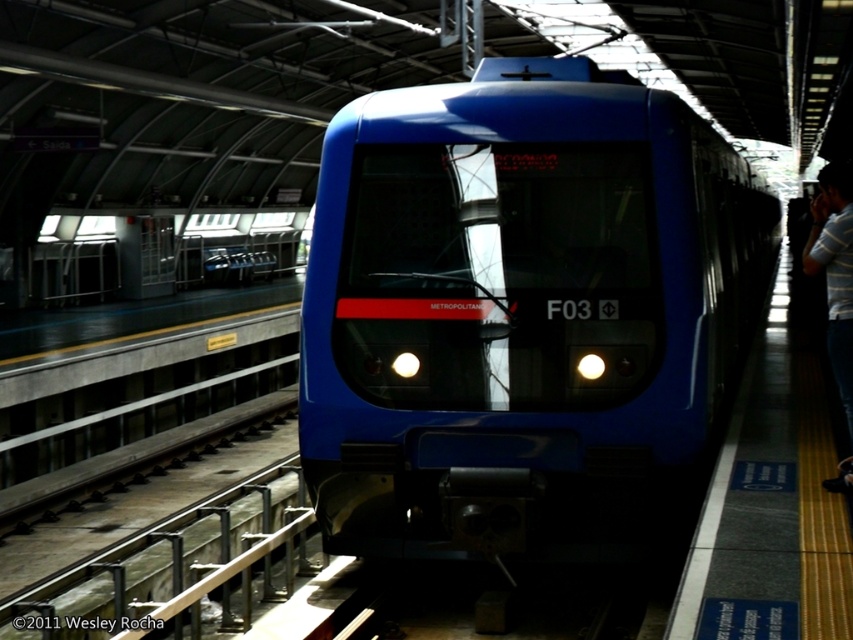
Question: Does blue glossy train at center appear on the left side of striped cotton shirt at right?

Choices:
 (A) yes
 (B) no

Answer: (A)

Question: Which of the following is the closest to the observer?

Choices:
 (A) striped cotton shirt at right
 (B) blue glossy train at center

Answer: (A)

Question: Which point is closer to the camera?

Choices:
 (A) blue glossy train at center
 (B) striped cotton shirt at right

Answer: (B)

Question: Is blue glossy train at center thinner than striped cotton shirt at right?

Choices:
 (A) yes
 (B) no

Answer: (A)

Question: Is blue glossy train at center above striped cotton shirt at right?

Choices:
 (A) no
 (B) yes

Answer: (A)